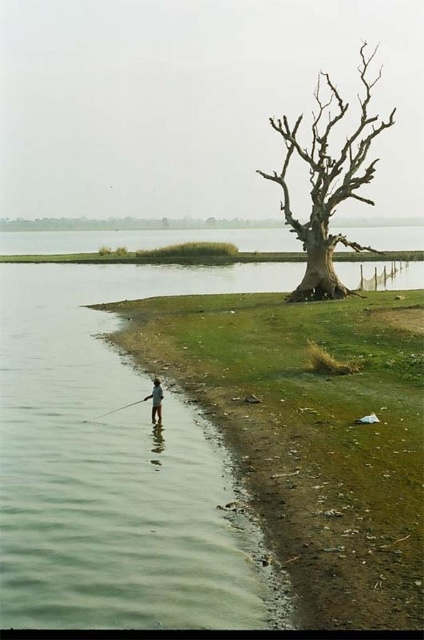
Does bare wood tree at center appear on the right side of light brown wooden pole at lower left?

Indeed, bare wood tree at center is positioned on the right side of light brown wooden pole at lower left.

Can you confirm if bare wood tree at center is positioned above light brown wooden pole at lower left?

Yes, bare wood tree at center is above light brown wooden pole at lower left.

Where is `bare wood tree at center`? bare wood tree at center is located at coordinates (329, 179).

Where is `bare wood tree at center`? The image size is (424, 640). bare wood tree at center is located at coordinates (329, 179).

Who is higher up, light brown wooden pole at lower left or smooth white fishing pole at lower left?

Positioned higher is light brown wooden pole at lower left.

Does light brown wooden pole at lower left have a larger size compared to smooth white fishing pole at lower left?

Incorrect, light brown wooden pole at lower left is not larger than smooth white fishing pole at lower left.

Measure the distance between light brown wooden pole at lower left and camera.

light brown wooden pole at lower left and camera are 33.44 feet apart from each other.

Locate an element on the screen. This screenshot has height=640, width=424. light brown wooden pole at lower left is located at coordinates (156, 401).

How much distance is there between bare wood tree at center and smooth white fishing pole at lower left?

bare wood tree at center is 39.67 meters away from smooth white fishing pole at lower left.

Is bare wood tree at center taller than smooth white fishing pole at lower left?

Indeed, bare wood tree at center has a greater height compared to smooth white fishing pole at lower left.

Who is more forward, (343, 100) or (145, 401)?

Positioned in front is point (145, 401).

Find the location of a particular element. This screenshot has width=424, height=640. bare wood tree at center is located at coordinates (329, 179).